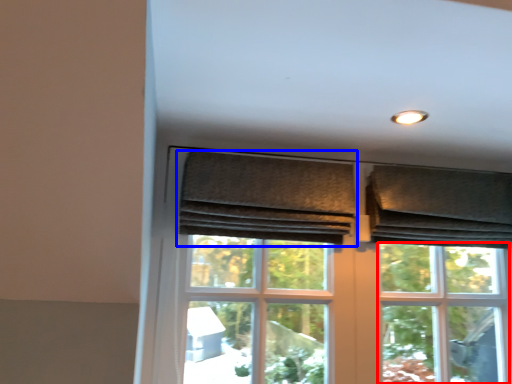
Question: Among these objects, which one is nearest to the camera, bay window (highlighted by a red box) or curtain (highlighted by a blue box)?

Choices:
 (A) bay window
 (B) curtain

Answer: (B)